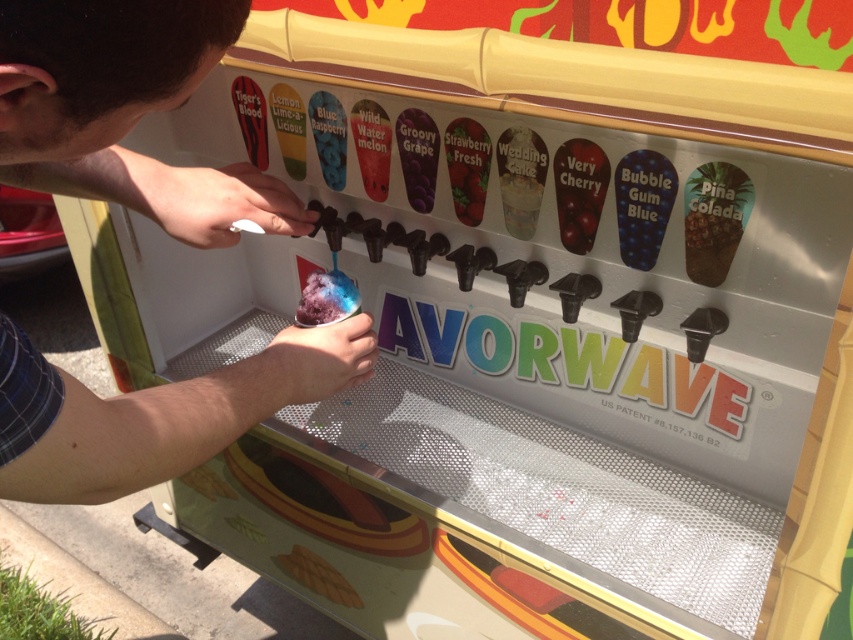
Question: Which object is the farthest from the gelatinous blue ice cream at center?

Choices:
 (A) matte white wedding cake at center
 (B) matte black cup at center

Answer: (A)

Question: Can you confirm if matte black cup at center is positioned above matte white wedding cake at center?

Choices:
 (A) no
 (B) yes

Answer: (A)

Question: Can you confirm if matte black cup at center is positioned to the right of gelatinous blue ice cream at center?

Choices:
 (A) no
 (B) yes

Answer: (A)

Question: Is matte white wedding cake at center smaller than gelatinous blue ice cream at center?

Choices:
 (A) no
 (B) yes

Answer: (B)

Question: Estimate the real-world distances between objects in this image. Which object is closer to the matte black cup at center?

Choices:
 (A) matte white wedding cake at center
 (B) gelatinous blue ice cream at center

Answer: (B)

Question: Which point is closer to the camera taking this photo?

Choices:
 (A) (338, 269)
 (B) (508, 172)
 (C) (305, 401)

Answer: (C)